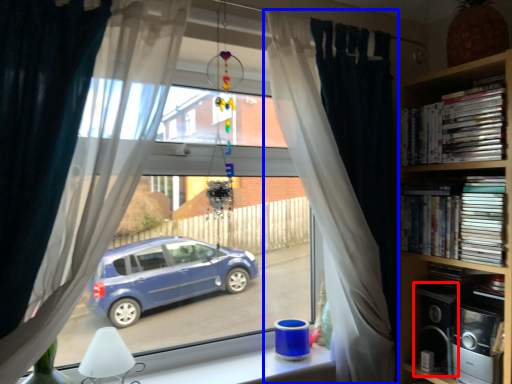
Question: Among these objects, which one is farthest to the camera, appliance (highlighted by a red box) or curtain (highlighted by a blue box)?

Choices:
 (A) appliance
 (B) curtain

Answer: (A)